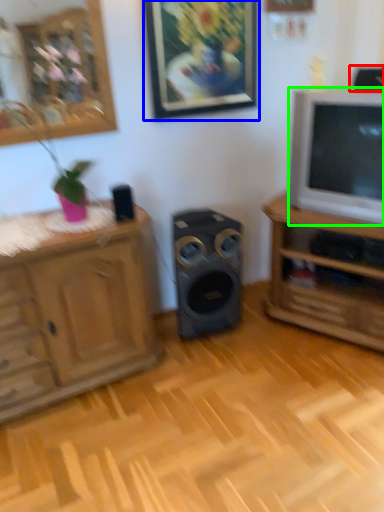
Question: Which object is the farthest from speaker (highlighted by a red box)? Choose among these: picture frame (highlighted by a blue box) or television (highlighted by a green box).

Choices:
 (A) picture frame
 (B) television

Answer: (A)